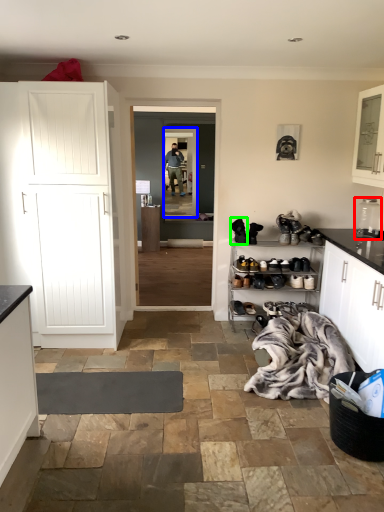
Question: Which is nearer to the appliance (highlighted by a red box)? glass door (highlighted by a blue box) or footwear (highlighted by a green box).

Choices:
 (A) glass door
 (B) footwear

Answer: (B)